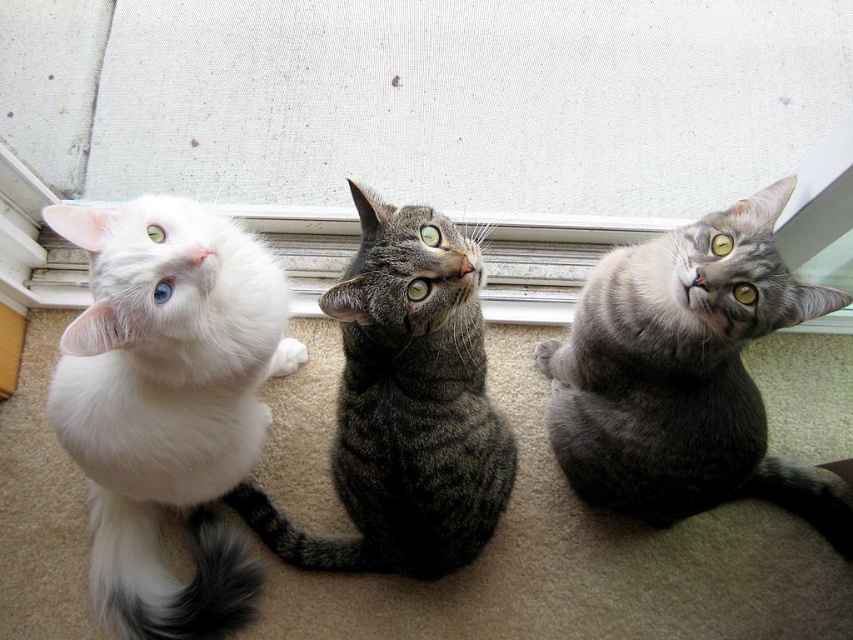
The height and width of the screenshot is (640, 853). Identify the location of white fabric window at upper center. (419, 124).

Is white fabric window at upper center above gray tabby cat at center?

Yes.

Between point (828, 225) and point (596, 378), which one is positioned in front?

Point (596, 378) is in front.

Image resolution: width=853 pixels, height=640 pixels. I want to click on white fabric window at upper center, so click(x=419, y=124).

Can you confirm if gray tabby cat at center is positioned to the right of tabby fur cat at center?

Yes, gray tabby cat at center is to the right of tabby fur cat at center.

Is point (665, 317) positioned after point (421, 540)?

No.

Where is `gray tabby cat at center`? The image size is (853, 640). gray tabby cat at center is located at coordinates (683, 372).

Who is more distant from viewer, (496, 166) or (454, 438)?

The point (496, 166) is behind.

Is white fabric window at upper center to the right of tabby fur cat at center from the viewer's perspective?

Yes, white fabric window at upper center is to the right of tabby fur cat at center.

Identify the location of white fabric window at upper center. (419, 124).

Where is `white fabric window at upper center`? The height and width of the screenshot is (640, 853). white fabric window at upper center is located at coordinates (419, 124).